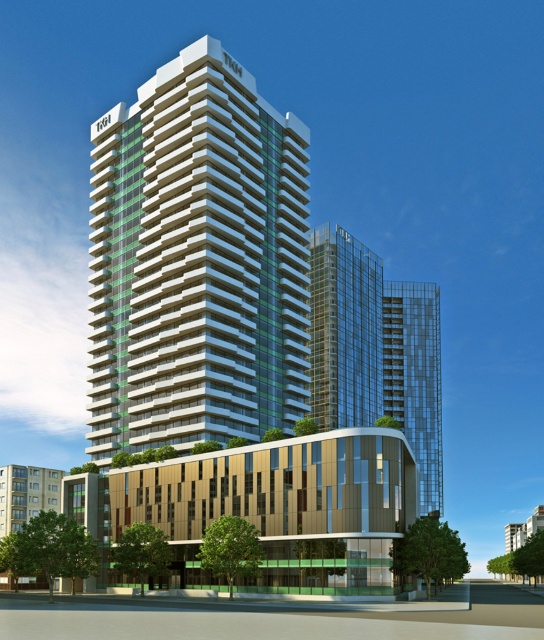
Question: Which point is closer to the camera?

Choices:
 (A) (423, 445)
 (B) (289, 248)
 (C) (358, 291)

Answer: (B)

Question: Is white glossy building at center smaller than transparent glass building at center?

Choices:
 (A) no
 (B) yes

Answer: (A)

Question: Is clear glass skyscraper at center bigger than transparent glass building at center?

Choices:
 (A) yes
 (B) no

Answer: (B)

Question: Considering the real-world distances, which object is farthest from the clear glass skyscraper at center?

Choices:
 (A) white glossy building at center
 (B) transparent glass building at center

Answer: (A)

Question: Considering the relative positions of white glossy building at center and transparent glass building at center in the image provided, where is white glossy building at center located with respect to transparent glass building at center?

Choices:
 (A) right
 (B) left

Answer: (B)

Question: Which object is the farthest from the transparent glass building at center?

Choices:
 (A) clear glass skyscraper at center
 (B) white glossy building at center

Answer: (B)